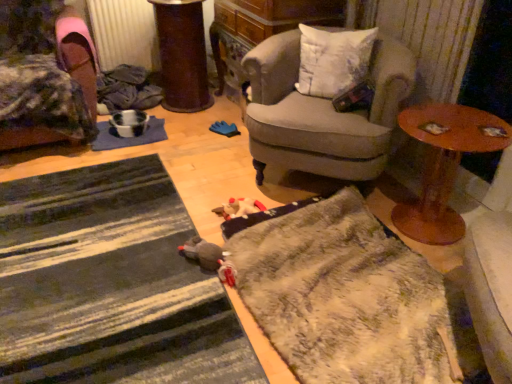
Question: Can you confirm if blue fabric mat at center-left is wider than white soft cushion at upper right?

Choices:
 (A) yes
 (B) no

Answer: (A)

Question: Considering the relative sizes of blue fabric mat at center-left and white soft cushion at upper right in the image provided, is blue fabric mat at center-left thinner than white soft cushion at upper right?

Choices:
 (A) no
 (B) yes

Answer: (A)

Question: Considering the relative sizes of blue fabric mat at center-left and white soft cushion at upper right in the image provided, is blue fabric mat at center-left taller than white soft cushion at upper right?

Choices:
 (A) yes
 (B) no

Answer: (B)

Question: Is blue fabric mat at center-left smaller than white soft cushion at upper right?

Choices:
 (A) no
 (B) yes

Answer: (B)

Question: Is blue fabric mat at center-left shorter than white soft cushion at upper right?

Choices:
 (A) no
 (B) yes

Answer: (B)

Question: Are blue fabric mat at center-left and white soft cushion at upper right located far from each other?

Choices:
 (A) yes
 (B) no

Answer: (A)

Question: Is metallic silver radiator at upper left oriented away from white soft cushion at upper right?

Choices:
 (A) no
 (B) yes

Answer: (A)

Question: Is metallic silver radiator at upper left bigger than white soft cushion at upper right?

Choices:
 (A) no
 (B) yes

Answer: (A)

Question: Does metallic silver radiator at upper left have a smaller size compared to white soft cushion at upper right?

Choices:
 (A) no
 (B) yes

Answer: (B)

Question: From a real-world perspective, does metallic silver radiator at upper left stand above white soft cushion at upper right?

Choices:
 (A) no
 (B) yes

Answer: (A)

Question: Is metallic silver radiator at upper left shorter than white soft cushion at upper right?

Choices:
 (A) no
 (B) yes

Answer: (A)

Question: Could you tell me if metallic silver radiator at upper left is turned towards white soft cushion at upper right?

Choices:
 (A) yes
 (B) no

Answer: (B)

Question: Can you confirm if fuzzy gray doormat at lower center, which appears as the 2th doormat when viewed from the left, is taller than gray fabric armchair at center, arranged as the 2th chair when viewed from the left?

Choices:
 (A) yes
 (B) no

Answer: (B)